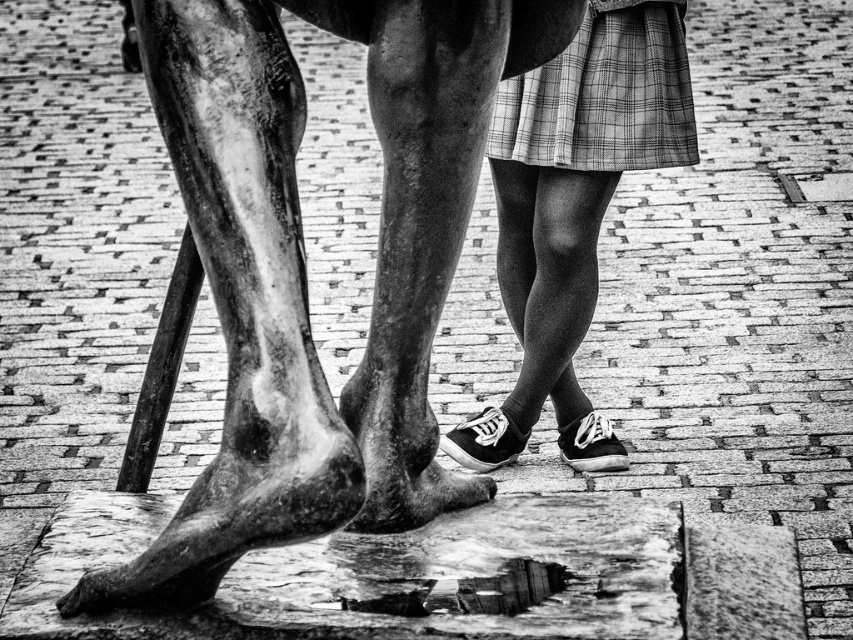
Which is behind, point (381, 292) or point (567, 100)?

The point (567, 100) is behind.

Locate an element on the screen. The width and height of the screenshot is (853, 640). bronze statue at center is located at coordinates (305, 266).